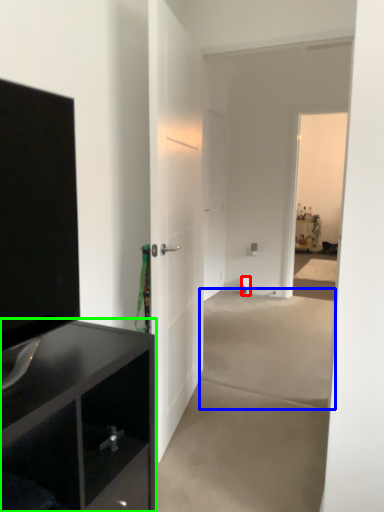
Question: Estimate the real-world distances between objects in this image. Which object is farther from toilet paper (highlighted by a red box), concrete (highlighted by a blue box) or cabinetry (highlighted by a green box)?

Choices:
 (A) concrete
 (B) cabinetry

Answer: (B)